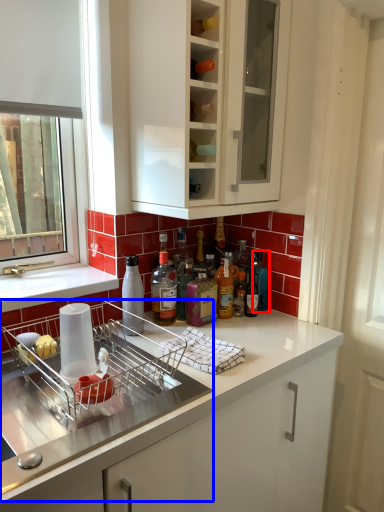
Question: Which object appears closest to the camera in this image, bottle (highlighted by a red box) or dish washer (highlighted by a blue box)?

Choices:
 (A) bottle
 (B) dish washer

Answer: (B)